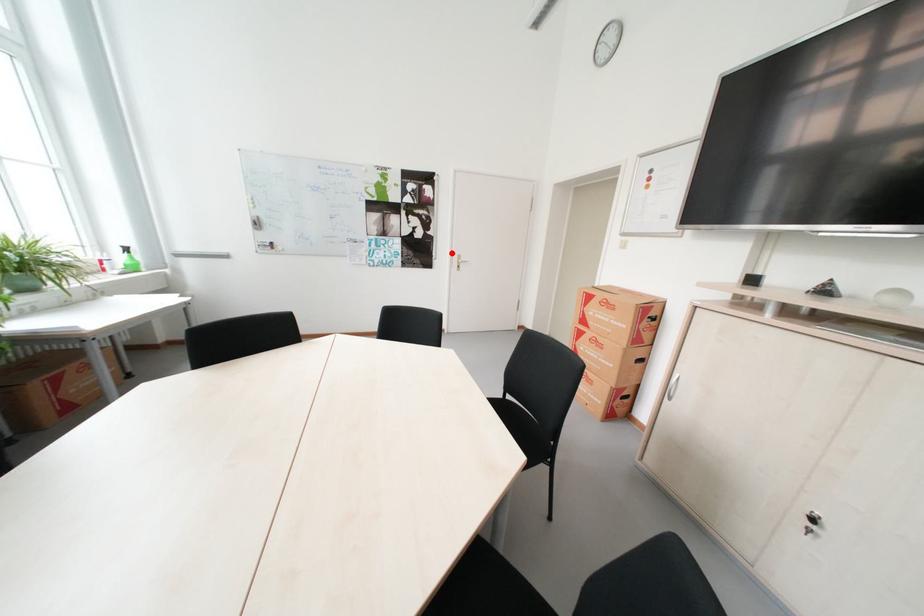
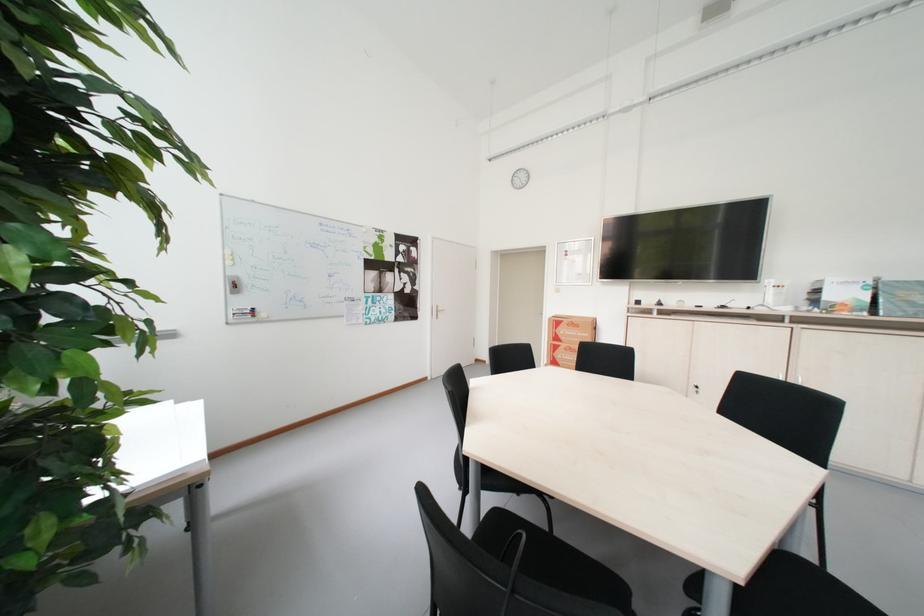
Find the pixel in the second image that matches the highlighted location in the first image.

(434, 305)